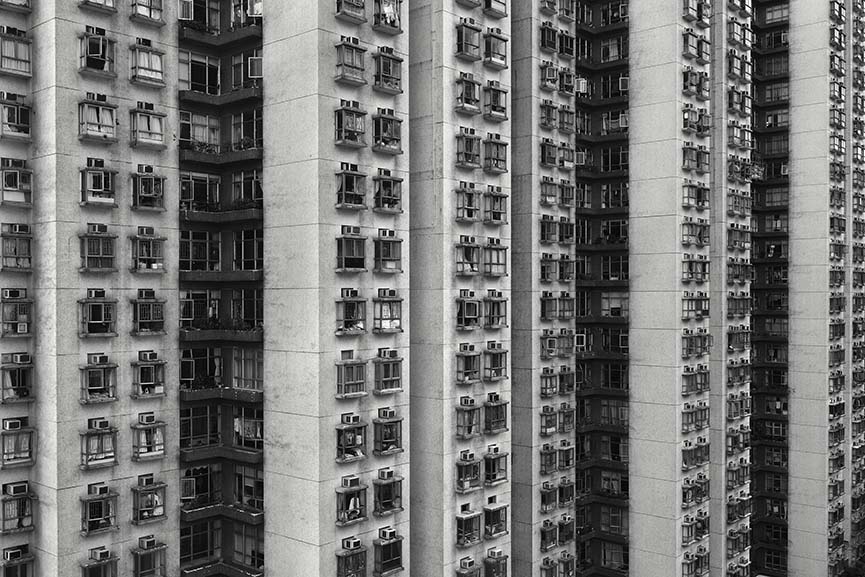
The height and width of the screenshot is (577, 865). What are the coordinates of `window unit farthest top right in image` in the screenshot? It's located at (860, 6).